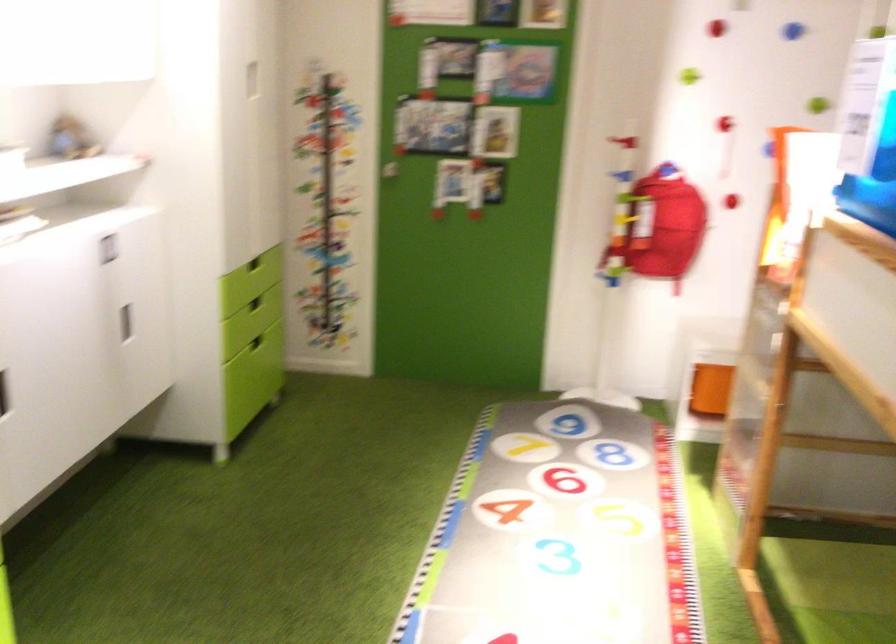
The image size is (896, 644). Identify the location of green climbing hold. (688, 76).